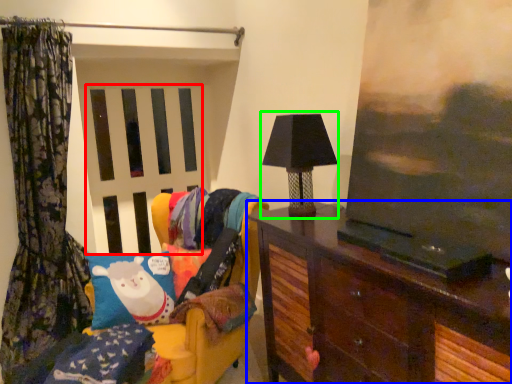
Question: Which object is positioned closest to screen door (highlighted by a red box)? Select from furniture (highlighted by a blue box) and table lamp (highlighted by a green box).

Choices:
 (A) furniture
 (B) table lamp

Answer: (B)